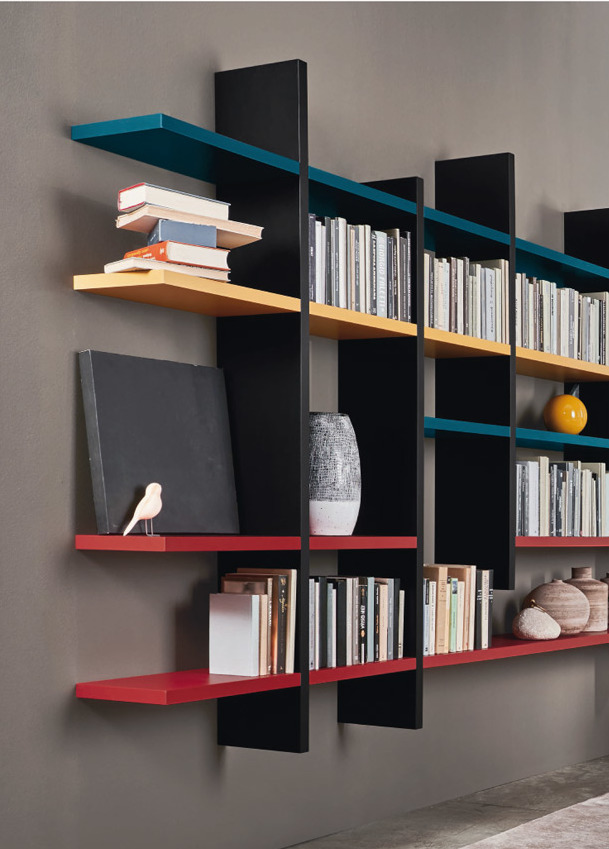
Find the location of a particular element. The image size is (609, 849). pottery is located at coordinates (336, 484), (533, 627), (555, 609), (604, 593).